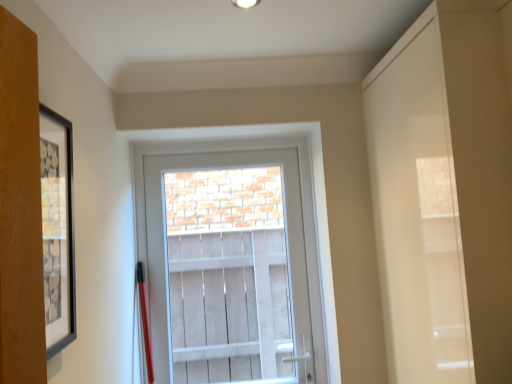
Image resolution: width=512 pixels, height=384 pixels. What do you see at coordinates (57, 229) in the screenshot? I see `black matte picture frame at left` at bounding box center [57, 229].

Locate an element on the screen. The height and width of the screenshot is (384, 512). black matte picture frame at left is located at coordinates 57,229.

Measure the distance between point [271,236] and camera.

Point [271,236] is 3.02 meters away from camera.

This screenshot has width=512, height=384. Find the location of `white glossy door at right`. white glossy door at right is located at coordinates (417, 211).

From the picture: Is black matte picture frame at left inside white glossy door at right?

No.

Consider the image. Which point is more distant from viewer, (396, 344) or (68, 249)?

The point (396, 344) is farther from the camera.

Are white glossy door at right and black matte picture frame at left beside each other?

white glossy door at right is not next to black matte picture frame at left, and they're not touching.

Can you tell me how much black matte picture frame at left and white glossy door at right differ in facing direction?

The angular difference between black matte picture frame at left and white glossy door at right is 179 degrees.

Is black matte picture frame at left next to white glossy door at right?

No, black matte picture frame at left is not in contact with white glossy door at right.

Is black matte picture frame at left facing away from white glossy door at right?

No, white glossy door at right is not at the back of black matte picture frame at left.

In the scene shown: Which of these two, white glossy door at right or clear glass door at center, is bigger?

Bigger between the two is white glossy door at right.

Is white glossy door at right not inside clear glass door at center?

Yes.

From the picture: Is white glossy door at right positioned with its back to clear glass door at center?

No, white glossy door at right is not facing away from clear glass door at center.

Considering the positions of objects white glossy door at right and clear glass door at center in the image provided, who is behind, white glossy door at right or clear glass door at center?

Positioned behind is clear glass door at center.

Considering the positions of objects clear glass door at center and white glossy door at right in the image provided, who is more to the left, clear glass door at center or white glossy door at right?

clear glass door at center.

From a real-world perspective, who is located higher, clear glass door at center or white glossy door at right?

In real-world perspective, white glossy door at right is above.

From the image's perspective, is clear glass door at center above or below white glossy door at right?

Clearly, from the image's perspective, clear glass door at center is below white glossy door at right.

Is black matte picture frame at left beside clear glass door at center?

black matte picture frame at left and clear glass door at center are clearly separated.

Is black matte picture frame at left oriented towards clear glass door at center?

No, black matte picture frame at left is not turned towards clear glass door at center.

From a real-world perspective, is black matte picture frame at left physically below clear glass door at center?

No, from a real-world perspective, black matte picture frame at left is not under clear glass door at center.

Which object is further away from the camera, black matte picture frame at left or clear glass door at center?

Positioned behind is clear glass door at center.

In terms of size, does clear glass door at center appear bigger or smaller than black matte picture frame at left?

clear glass door at center is bigger than black matte picture frame at left.

Based on the photo, how different are the orientations of clear glass door at center and black matte picture frame at left in degrees?

The angle between the facing direction of clear glass door at center and the facing direction of black matte picture frame at left is 89.2 degrees.

From the image's perspective, which is below, clear glass door at center or black matte picture frame at left?

From the image's view, clear glass door at center is below.

Considering the points (267, 251) and (64, 241), which point is in front, point (267, 251) or point (64, 241)?

Positioned in front is point (64, 241).

At what (x,y) coordinates should I click in order to perform the action: click on door that is on the right side of black matte picture frame at left. Please return your answer as a coordinate pair (x, y). This screenshot has height=384, width=512. Looking at the image, I should click on (417, 211).

The width and height of the screenshot is (512, 384). What are the coordinates of `picture frame above the white glossy door at right (from the image's perspective)` in the screenshot? It's located at (57, 229).

Which object lies further to the anchor point black matte picture frame at left, clear glass door at center or white glossy door at right?

clear glass door at center is further to black matte picture frame at left.

Looking at the image, which one is located further to black matte picture frame at left, white glossy door at right or clear glass door at center?

clear glass door at center is positioned further to the anchor black matte picture frame at left.

Based on their spatial positions, is white glossy door at right or black matte picture frame at left further from clear glass door at center?

The object further to clear glass door at center is black matte picture frame at left.

When comparing their distances from white glossy door at right, does black matte picture frame at left or clear glass door at center seem closer?

black matte picture frame at left lies closer to white glossy door at right than the other object.

Based on their spatial positions, is clear glass door at center or black matte picture frame at left closer to white glossy door at right?

black matte picture frame at left is closer to white glossy door at right.

Which object lies further to the anchor point clear glass door at center, black matte picture frame at left or white glossy door at right?

The object further to clear glass door at center is black matte picture frame at left.

The height and width of the screenshot is (384, 512). In order to click on glass door between black matte picture frame at left and white glossy door at right from left to right in this screenshot , I will do `click(228, 268)`.